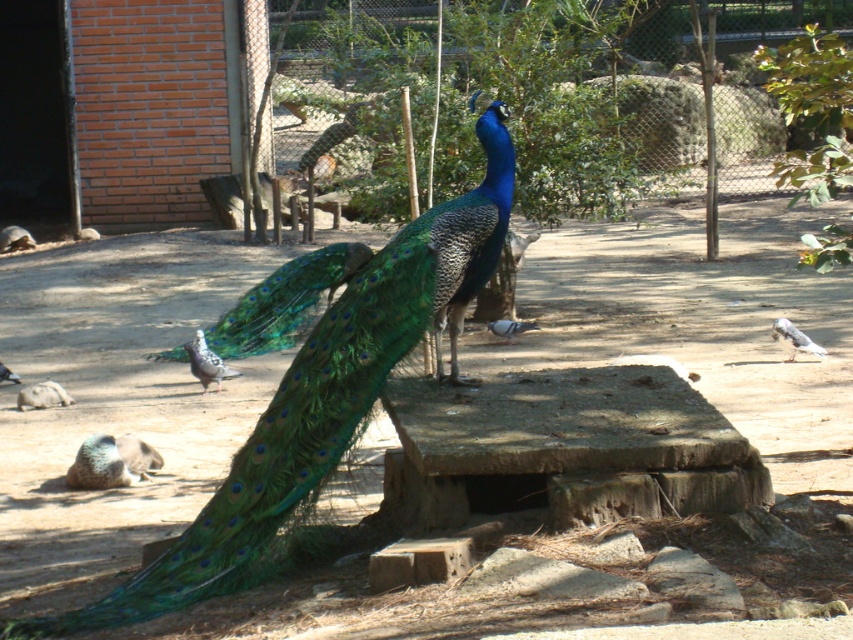
Question: Which point is farther to the camera?

Choices:
 (A) (49, 625)
 (B) (155, 451)

Answer: (B)

Question: Is gray speckled pigeon at lower left positioned in front of white feathered bird at right?

Choices:
 (A) yes
 (B) no

Answer: (A)

Question: Which object appears farthest from the camera in this image?

Choices:
 (A) gray matte rock at lower left
 (B) white feathered bird at right
 (C) matte gray pigeon at lower left

Answer: (B)

Question: Which object appears farthest from the camera in this image?

Choices:
 (A) white feathered bird at right
 (B) shiny blue peacock at center
 (C) matte gray pigeon at lower left
 (D) gray speckled pigeon at lower left

Answer: (A)

Question: From the image, what is the correct spatial relationship of gray matte rock at lower left in relation to white feathered bird at right?

Choices:
 (A) below
 (B) above

Answer: (A)

Question: Is gray speckled pigeon at lower left thinner than gray matte pigeon at center?

Choices:
 (A) yes
 (B) no

Answer: (A)